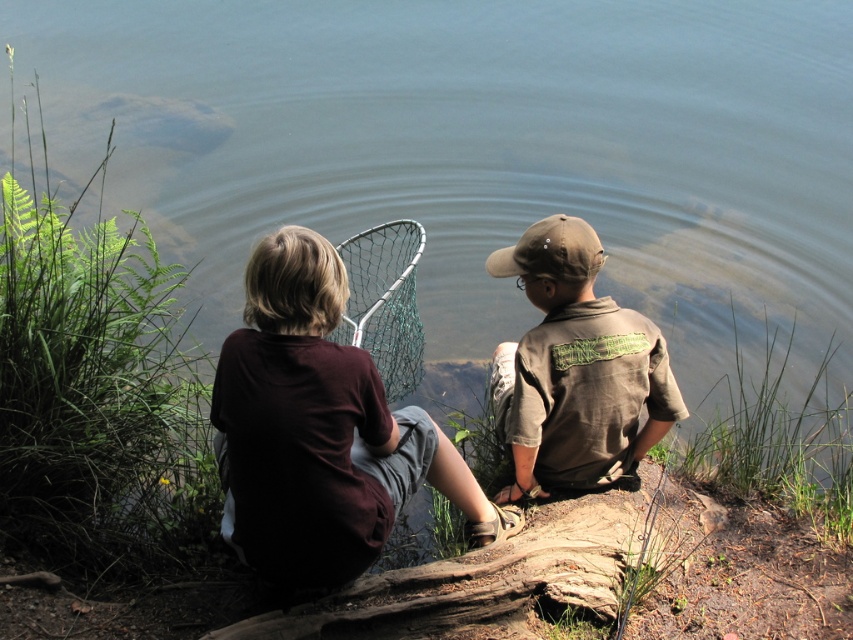
Question: Among these points, which one is nearest to the camera?

Choices:
 (A) (555, 515)
 (B) (412, 378)
 (C) (550, 237)
 (D) (340, 260)

Answer: (D)

Question: Does dark brown shirt at center have a smaller size compared to brown cotton shirt at center?

Choices:
 (A) yes
 (B) no

Answer: (B)

Question: Which point is closer to the camera?

Choices:
 (A) (408, 358)
 (B) (492, 266)
 (C) (216, 445)
 (D) (392, 600)

Answer: (D)

Question: Which of these objects is positioned farthest from the brown cotton shirt at center?

Choices:
 (A) dark brown shirt at center
 (B) brown rough wood log at lower center
 (C) green mesh fishing net at center

Answer: (C)

Question: Does dark brown shirt at center appear over brown cotton shirt at center?

Choices:
 (A) yes
 (B) no

Answer: (B)

Question: Can you confirm if dark brown shirt at center is smaller than brown rough wood log at lower center?

Choices:
 (A) no
 (B) yes

Answer: (A)